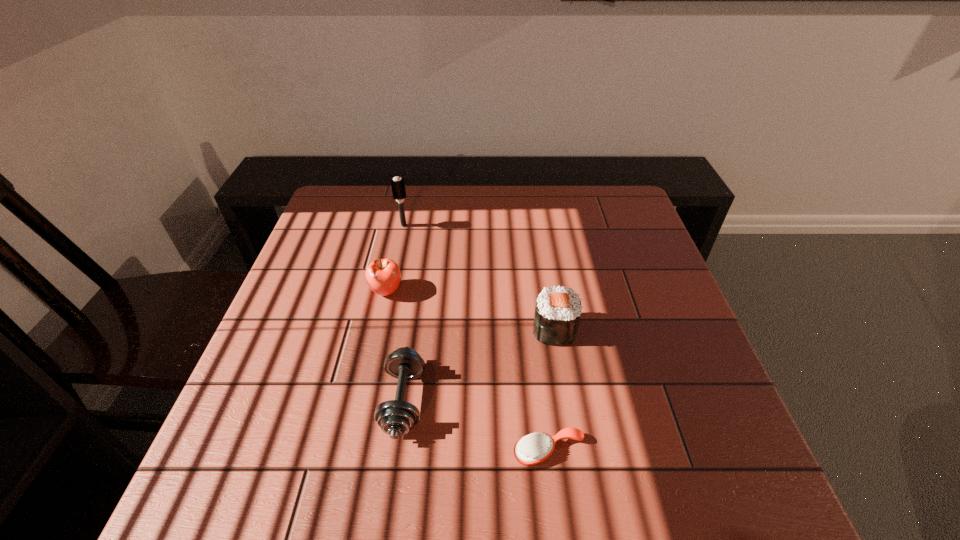
Locate an element on the screen. Image resolution: width=960 pixels, height=540 pixels. object identified as the third closest to the third farthest object is located at coordinates (383, 276).

You are a GUI agent. You are given a task and a screenshot of the screen. Output one action in this format:
    pyautogui.click(x=<x>, y=<y>)
    Task: Click on the object that is the closest to the fourth tallest object
    
    Given the screenshot: What is the action you would take?
    pyautogui.click(x=383, y=276)

This screenshot has height=540, width=960. What are the coordinates of `free space that satisfies the following two spatial constraints: 1. on the front side of the shortest object; 2. on the left side of the fourth nearest object` in the screenshot? It's located at (351, 451).

Identify the location of free location that satisfies the following two spatial constraints: 1. on the front side of the nearer hairbrush; 2. on the left side of the taller hairbrush. The height and width of the screenshot is (540, 960). (356, 451).

You are a GUI agent. You are given a task and a screenshot of the screen. Output one action in this format:
    pyautogui.click(x=<x>, y=<y>)
    Task: Click on the free point that satisfies the following two spatial constraints: 1. on the back side of the sushi; 2. on the right side of the right hairbrush
    Image resolution: width=960 pixels, height=540 pixels.
    Given the screenshot: What is the action you would take?
    pyautogui.click(x=535, y=330)

Where is `blank space that satisfies the following two spatial constraints: 1. on the front side of the taller hairbrush; 2. on the right side of the fourth tallest object`? Image resolution: width=960 pixels, height=540 pixels. blank space that satisfies the following two spatial constraints: 1. on the front side of the taller hairbrush; 2. on the right side of the fourth tallest object is located at coordinates (367, 401).